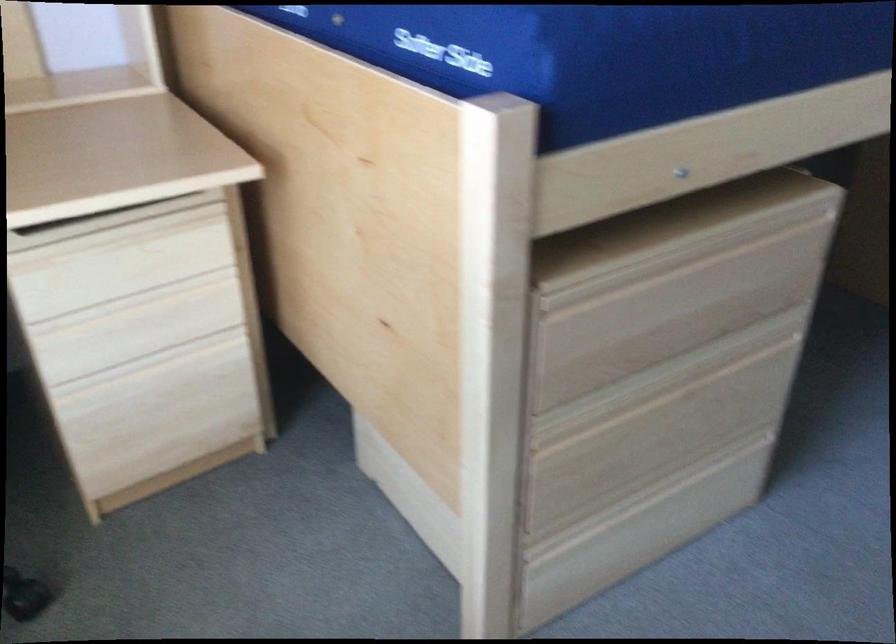
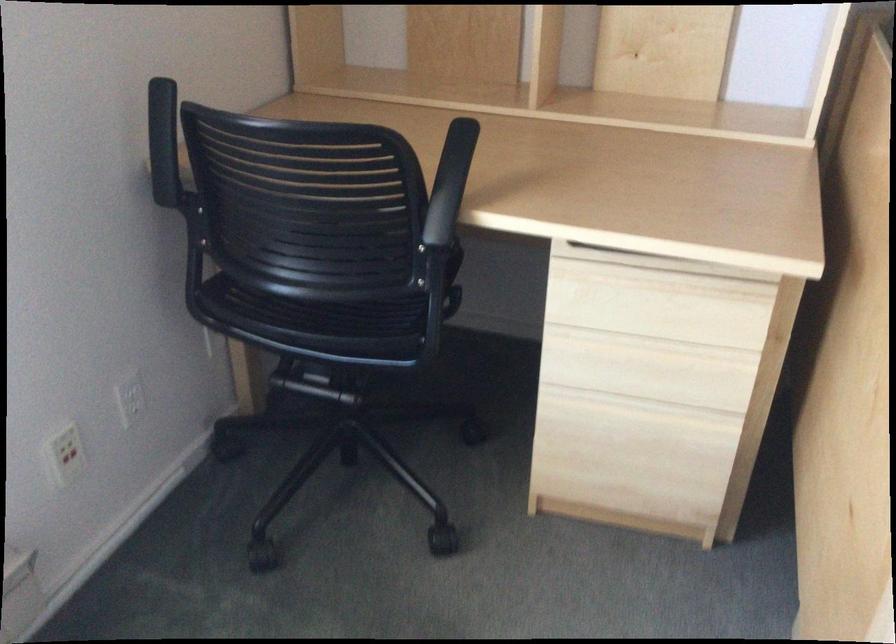
Find the pixel in the second image that matches point 143,298 in the first image.

(652, 345)